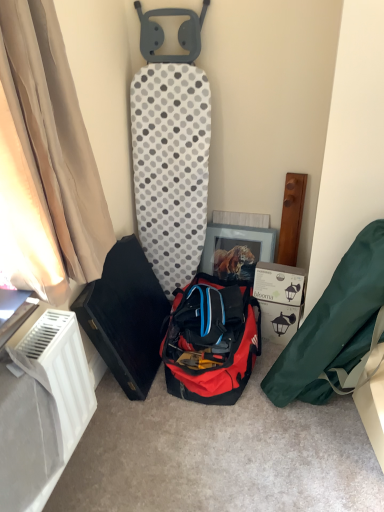
Describe the element at coordinates (47, 157) in the screenshot. I see `beige fabric curtain at left` at that location.

The image size is (384, 512). In order to click on white plastic radiator at lower left in this screenshot , I will do `click(60, 371)`.

Identify the location of red fabric duffel bag at center. The width and height of the screenshot is (384, 512). (211, 341).

Describe the element at coordinates (279, 298) in the screenshot. I see `white cardboard box at lower right` at that location.

Identify the location of black hard case at left, which ranks as the 1th kit in left-to-right order. point(125,316).

Considering the positions of point (149, 282) and point (73, 199), is point (149, 282) closer or farther from the camera than point (73, 199)?

Point (149, 282) is positioned farther from the camera compared to point (73, 199).

Does black hard case at left, which ranks as the 1th kit in left-to-right order, turn towards beige fabric curtain at left?

No, black hard case at left, which ranks as the 1th kit in left-to-right order, is not facing towards beige fabric curtain at left.

From the image's perspective, would you say black hard case at left, which ranks as the 1th kit in left-to-right order, is shown under beige fabric curtain at left?

Correct, black hard case at left, which ranks as the 1th kit in left-to-right order, appears lower than beige fabric curtain at left in the image.

Does black hard case at left, the second kit in the right-to-left sequence, have a smaller size compared to beige fabric curtain at left?

Actually, black hard case at left, the second kit in the right-to-left sequence, might be larger than beige fabric curtain at left.

Could you tell me if beige fabric curtain at left is facing white cardboard box at lower right?

No.

Considering the sizes of beige fabric curtain at left and white cardboard box at lower right in the image, is beige fabric curtain at left taller or shorter than white cardboard box at lower right?

Clearly, beige fabric curtain at left is taller compared to white cardboard box at lower right.

Based on the photo, are beige fabric curtain at left and white cardboard box at lower right far apart?

No.

Which is in front, point (71, 145) or point (295, 269)?

The point (71, 145) is closer to the camera.

Does point (297, 374) lie behind point (183, 297)?

That is False.

Can you confirm if green fabric bag at lower right, arranged as the 2th kit when viewed from the left, is taller than red fabric duffel bag at center?

Yes.

In the image, is green fabric bag at lower right, the first kit in the right-to-left sequence, positioned in front of or behind red fabric duffel bag at center?

green fabric bag at lower right, the first kit in the right-to-left sequence, is in front of red fabric duffel bag at center.

The image size is (384, 512). There is a red fabric duffel bag at center. Find the location of `the 2nd kit above it (from a real-world perspective)`. the 2nd kit above it (from a real-world perspective) is located at coordinates (333, 326).

From the image's perspective, is black hard case at left, the second kit in the right-to-left sequence, located beneath green fabric bag at lower right, the first kit in the right-to-left sequence?

No.

Between black hard case at left, the second kit in the right-to-left sequence, and green fabric bag at lower right, the first kit in the right-to-left sequence, which one appears on the left side from the viewer's perspective?

Positioned to the left is black hard case at left, the second kit in the right-to-left sequence.

Which object is more forward, black hard case at left, which ranks as the 1th kit in left-to-right order, or green fabric bag at lower right, arranged as the 2th kit when viewed from the left?

green fabric bag at lower right, arranged as the 2th kit when viewed from the left, is closer to the camera.

Does beige fabric curtain at left appear on the left side of white plastic radiator at lower left?

Incorrect, beige fabric curtain at left is not on the left side of white plastic radiator at lower left.

Is beige fabric curtain at left in contact with white plastic radiator at lower left?

No, beige fabric curtain at left is not beside white plastic radiator at lower left.

Is white plastic radiator at lower left at the back of beige fabric curtain at left?

That's not correct — beige fabric curtain at left is not looking away from white plastic radiator at lower left.

Considering their positions, is beige fabric curtain at left located in front of or behind white plastic radiator at lower left?

beige fabric curtain at left is positioned closer to the viewer than white plastic radiator at lower left.

Would you say white cardboard box at lower right is inside or outside black hard case at left, the second kit in the right-to-left sequence?

white cardboard box at lower right is not inside black hard case at left, the second kit in the right-to-left sequence, it's outside.

From a real-world perspective, which object stands above the other?

black hard case at left, which ranks as the 1th kit in left-to-right order.

Is white cardboard box at lower right oriented towards black hard case at left, the second kit in the right-to-left sequence?

No, white cardboard box at lower right is not turned towards black hard case at left, the second kit in the right-to-left sequence.

Does white cardboard box at lower right appear on the right side of black hard case at left, which ranks as the 1th kit in left-to-right order?

Yes, white cardboard box at lower right is to the right of black hard case at left, which ranks as the 1th kit in left-to-right order.

From the picture: Is red fabric duffel bag at center shorter than beige fabric curtain at left?

Yes.

How distant is red fabric duffel bag at center from beige fabric curtain at left?

A distance of 30.28 inches exists between red fabric duffel bag at center and beige fabric curtain at left.

Is point (251, 301) in front of point (16, 151)?

No, (251, 301) is behind (16, 151).

Can you see red fabric duffel bag at center touching beige fabric curtain at left?

There is a gap between red fabric duffel bag at center and beige fabric curtain at left.

I want to click on curtain on the left of black hard case at left, the second kit in the right-to-left sequence, so click(47, 157).

The width and height of the screenshot is (384, 512). Find the location of `cardboard box behind the beige fabric curtain at left`. cardboard box behind the beige fabric curtain at left is located at coordinates (279, 298).

From the image, which object appears to be nearer to white plastic radiator at lower left, red fabric duffel bag at center or black hard case at left, the second kit in the right-to-left sequence?

black hard case at left, the second kit in the right-to-left sequence.

Estimate the real-world distances between objects in this image. Which object is closer to red fabric duffel bag at center, beige fabric curtain at left or white plastic radiator at lower left?

white plastic radiator at lower left is positioned closer to the anchor red fabric duffel bag at center.

Which object lies further to the anchor point white cardboard box at lower right, black hard case at left, the second kit in the right-to-left sequence, or white plastic radiator at lower left?

white plastic radiator at lower left is further to white cardboard box at lower right.

When comparing their distances from white cardboard box at lower right, does black hard case at left, which ranks as the 1th kit in left-to-right order, or red fabric duffel bag at center seem closer?

The object closer to white cardboard box at lower right is red fabric duffel bag at center.

From the picture: Which object lies further to the anchor point white plastic radiator at lower left, beige fabric curtain at left or white cardboard box at lower right?

white cardboard box at lower right is positioned further to the anchor white plastic radiator at lower left.

When comparing their distances from black hard case at left, the second kit in the right-to-left sequence, does white cardboard box at lower right or white plastic radiator at lower left seem further?

white cardboard box at lower right is further to black hard case at left, the second kit in the right-to-left sequence.

Considering their positions, is black hard case at left, the second kit in the right-to-left sequence, positioned further to white cardboard box at lower right than green fabric bag at lower right, the first kit in the right-to-left sequence?

black hard case at left, the second kit in the right-to-left sequence, lies further to white cardboard box at lower right than the other object.

Which object lies further to the anchor point red fabric duffel bag at center, white plastic radiator at lower left or green fabric bag at lower right, arranged as the 2th kit when viewed from the left?

Among the two, white plastic radiator at lower left is located further to red fabric duffel bag at center.

Locate an element on the screen. This screenshot has width=384, height=512. kit between white plastic radiator at lower left and green fabric bag at lower right, the first kit in the right-to-left sequence, in the horizontal direction is located at coordinates (125, 316).

Find the location of a particular element. This screenshot has height=512, width=384. curtain between white plastic radiator at lower left and green fabric bag at lower right, arranged as the 2th kit when viewed from the left, in the horizontal direction is located at coordinates (47, 157).

Locate an element on the screen. cardboard box situated between white plastic radiator at lower left and green fabric bag at lower right, the first kit in the right-to-left sequence, from left to right is located at coordinates (279, 298).

Image resolution: width=384 pixels, height=512 pixels. Find the location of `luggage and bags between beige fabric curtain at left and white cardboard box at lower right along the z-axis`. luggage and bags between beige fabric curtain at left and white cardboard box at lower right along the z-axis is located at coordinates (211, 341).